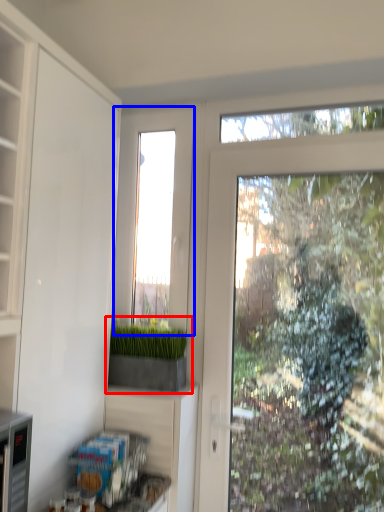
Question: Which object appears closest to the camera in this image, houseplant (highlighted by a red box) or window (highlighted by a blue box)?

Choices:
 (A) houseplant
 (B) window

Answer: (A)